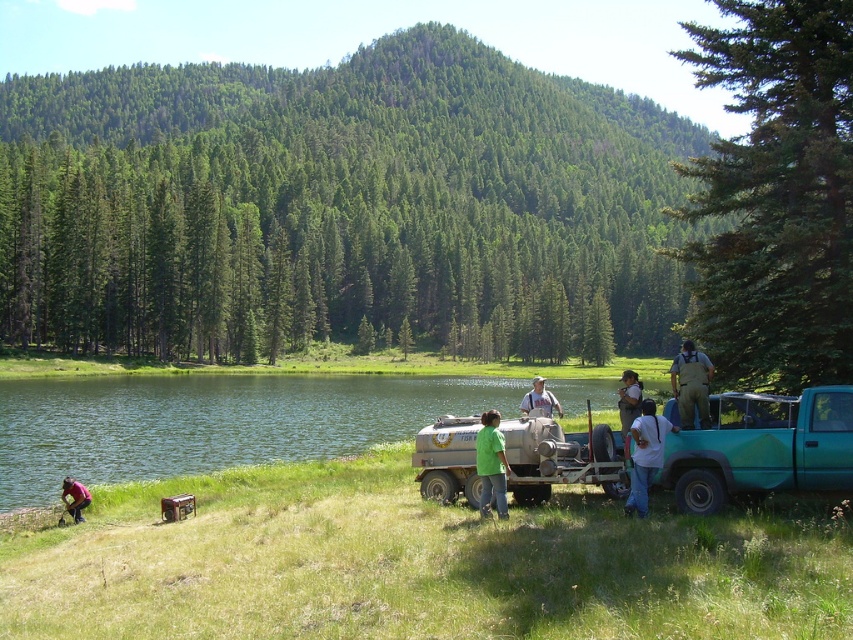
You are a photographer standing at the center of the scene. You want to take a picture of the white cotton shirt at lower right. In which direction should you move to get a better shot?

The white cotton shirt at lower right is located at point (645, 456), so you should move to the lower right direction to get a better shot.

You are a safety inspector standing near the teal pickup truck and need to check the distance between the white cotton shirt at lower right and the green matte shirt at center. According to safety regulations, workers must maintain at least 5 feet of distance. Is the current distance compliant?

The white cotton shirt at lower right is 7.10 feet away from the green matte shirt at center, which exceeds the required 5 feet distance, so it is compliant with safety regulations.

You are a photographer standing in the middle of the scene. You want to take a photo of the teal matte truck at right and the white cotton shirt at lower right. Which object is positioned to the right side of the other?

The teal matte truck at right is to the right of the white cotton shirt at lower right according to the description.